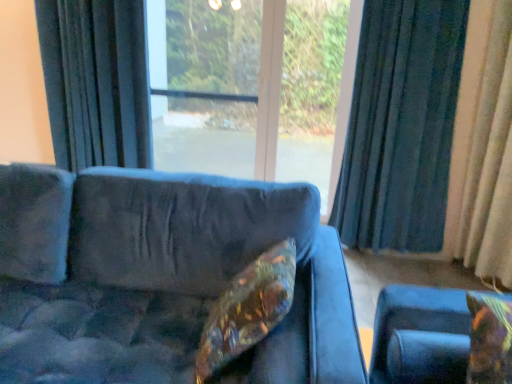
Question: Is shiny metallic pillow at center, the first pillow viewed from the left, positioned behind beige fabric curtain at right, which is the first curtain from right to left?

Choices:
 (A) no
 (B) yes

Answer: (A)

Question: From a real-world perspective, is shiny metallic pillow at center, the first pillow viewed from the left, located beneath beige fabric curtain at right, the 3th curtain when ordered from left to right?

Choices:
 (A) no
 (B) yes

Answer: (B)

Question: Does shiny metallic pillow at center, which ranks as the second pillow in right-to-left order, have a lesser width compared to beige fabric curtain at right, the 3th curtain when ordered from left to right?

Choices:
 (A) yes
 (B) no

Answer: (B)

Question: Can you confirm if shiny metallic pillow at center, which ranks as the second pillow in right-to-left order, is wider than beige fabric curtain at right, the 3th curtain when ordered from left to right?

Choices:
 (A) no
 (B) yes

Answer: (B)

Question: From the image's perspective, is shiny metallic pillow at center, the first pillow viewed from the left, beneath beige fabric curtain at right, the 3th curtain when ordered from left to right?

Choices:
 (A) yes
 (B) no

Answer: (A)

Question: From a real-world perspective, relative to velvet-like floral pillow at lower right, arranged as the 1th pillow when viewed from the right, is transparent glass screen door at center vertically above or below?

Choices:
 (A) above
 (B) below

Answer: (A)

Question: In terms of size, does transparent glass screen door at center appear bigger or smaller than velvet-like floral pillow at lower right, which is the 2th pillow from left to right?

Choices:
 (A) big
 (B) small

Answer: (A)

Question: Relative to velvet-like floral pillow at lower right, which is the 2th pillow from left to right, is transparent glass screen door at center in front or behind?

Choices:
 (A) front
 (B) behind

Answer: (B)

Question: Would you say transparent glass screen door at center is to the left or to the right of velvet-like floral pillow at lower right, arranged as the 1th pillow when viewed from the right, in the picture?

Choices:
 (A) left
 (B) right

Answer: (A)

Question: In the image, is dark blue fabric curtain at right, the second curtain viewed from the left, positioned in front of or behind velvet-like floral pillow at lower right, which is the 2th pillow from left to right?

Choices:
 (A) behind
 (B) front

Answer: (A)

Question: Is dark blue fabric curtain at right, which is the second curtain in right-to-left order, to the left or to the right of velvet-like floral pillow at lower right, arranged as the 1th pillow when viewed from the right, in the image?

Choices:
 (A) right
 (B) left

Answer: (A)

Question: Is point (395, 185) closer or farther from the camera than point (468, 304)?

Choices:
 (A) closer
 (B) farther

Answer: (B)

Question: From the image's perspective, relative to velvet-like floral pillow at lower right, which is the 2th pillow from left to right, is dark blue fabric curtain at right, the second curtain viewed from the left, above or below?

Choices:
 (A) above
 (B) below

Answer: (A)

Question: Does point (121, 31) appear closer or farther from the camera than point (269, 301)?

Choices:
 (A) farther
 (B) closer

Answer: (A)

Question: In the image, is dark blue fabric curtain at left, which is counted as the 1th curtain, starting from the left, on the left side or the right side of shiny metallic pillow at center, the first pillow viewed from the left?

Choices:
 (A) left
 (B) right

Answer: (A)